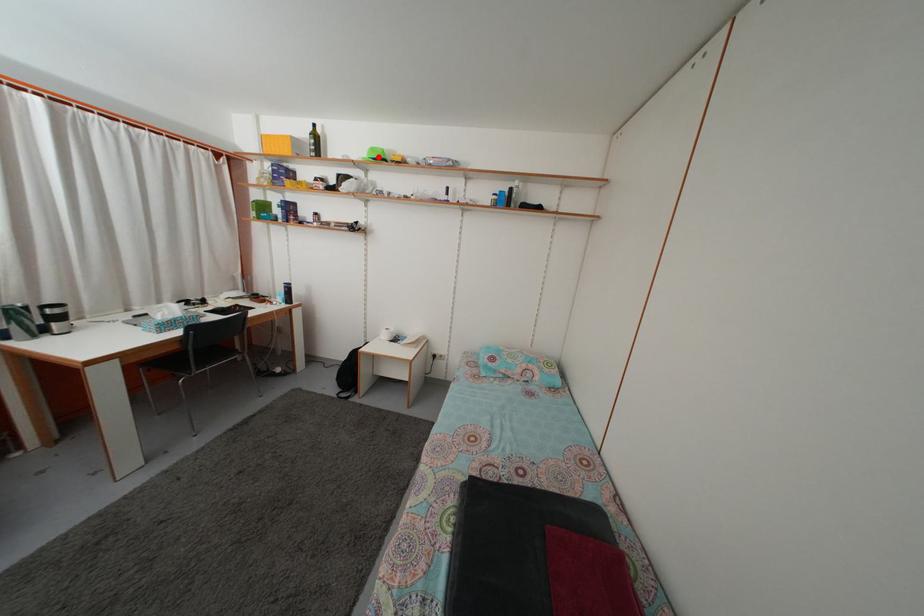
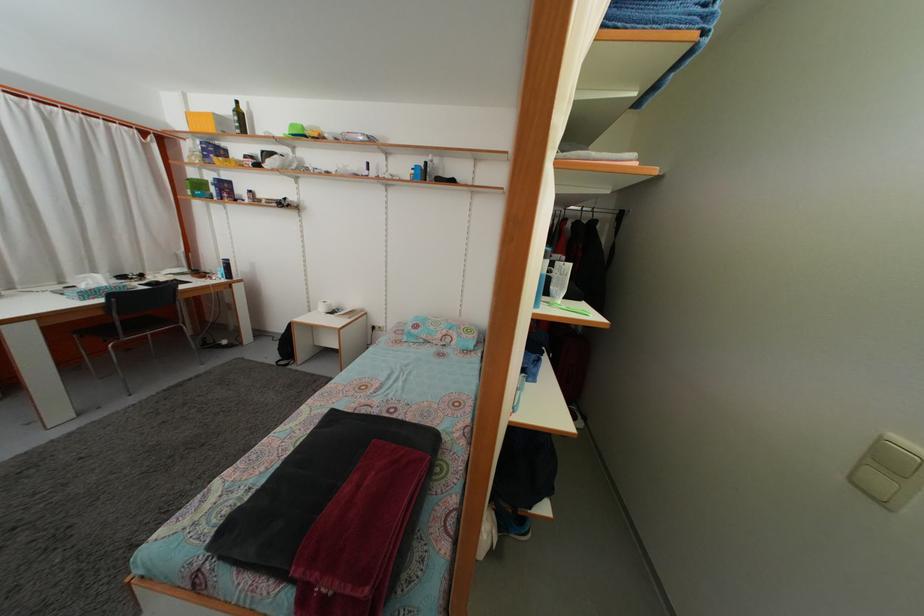
Where in the second image is the point corresponding to the highlighted location from the first image?

(298, 132)